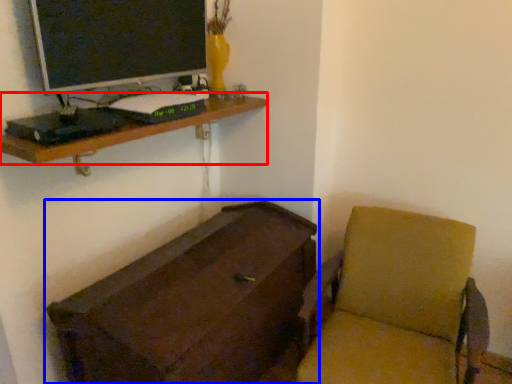
Question: Which object is further to the camera taking this photo, shelf (highlighted by a red box) or furniture (highlighted by a blue box)?

Choices:
 (A) shelf
 (B) furniture

Answer: (A)